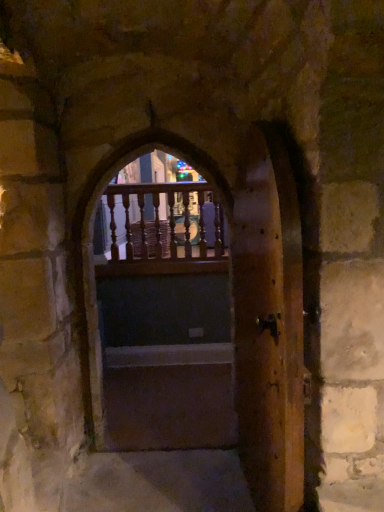
Image resolution: width=384 pixels, height=512 pixels. In order to click on blank space situated above dark wood door at center (from a real-world perspective) in this screenshot , I will do `click(161, 402)`.